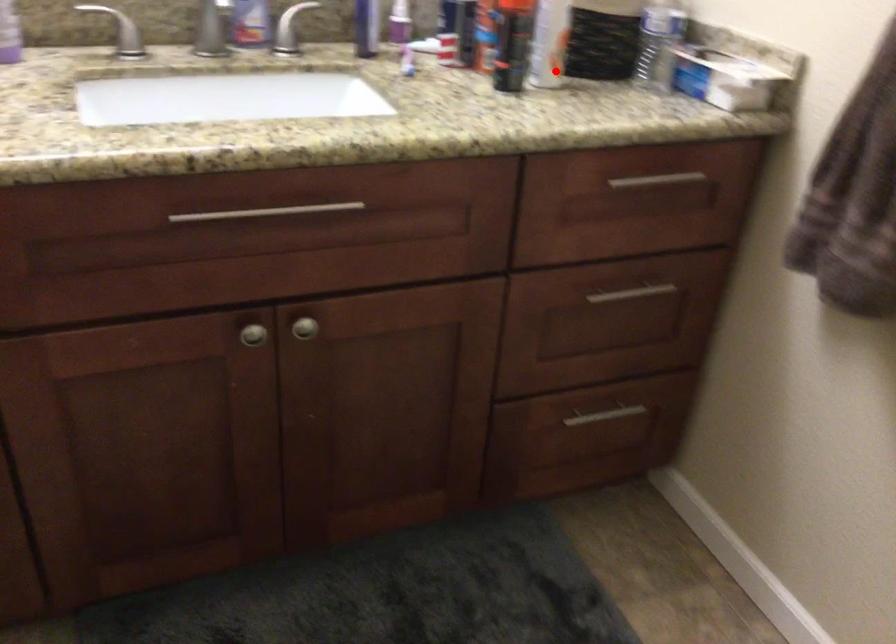
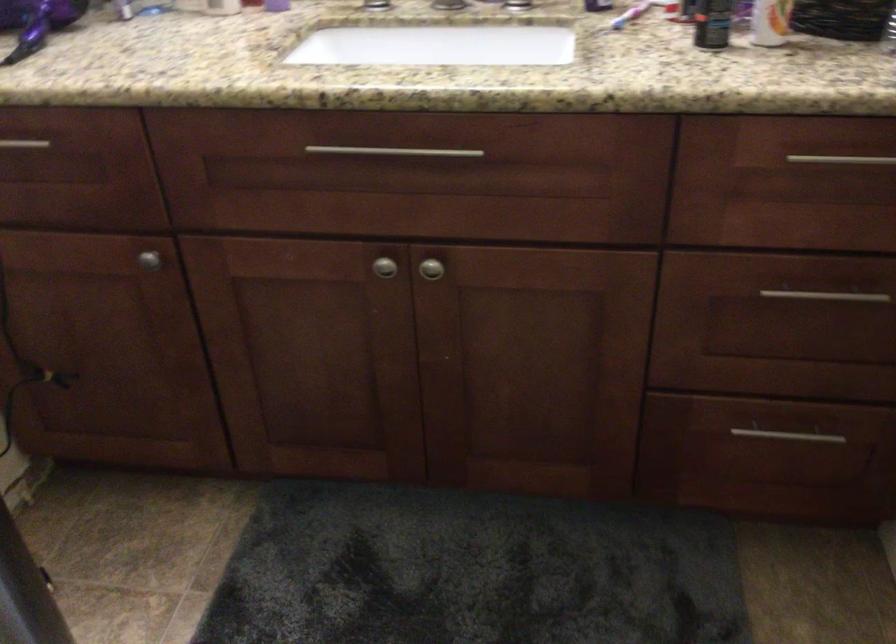
Question: I am providing you with two images of the same scene from different viewpoints. Given a red point in image1, look at the same physical point in image2. Is it:

Choices:
 (A) Closer to the viewpoint
 (B) Farther from the viewpoint

Answer: (A)